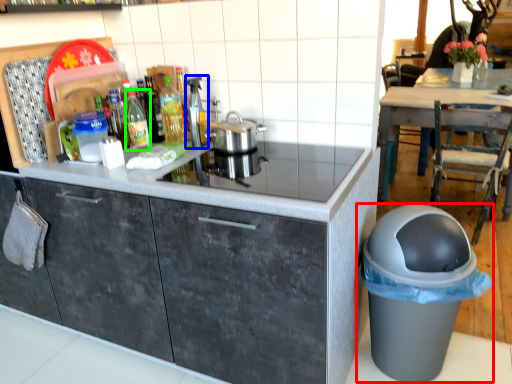
Question: Estimate the real-world distances between objects in this image. Which object is closer to waste container (highlighted by a red box), appliance (highlighted by a blue box) or bottle (highlighted by a green box)?

Choices:
 (A) appliance
 (B) bottle

Answer: (A)